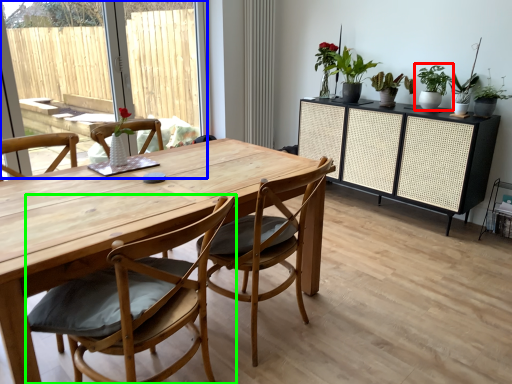
Question: Based on their relative distances, which object is farther from houseplant (highlighted by a red box)? Choose from window screen (highlighted by a blue box) and chair (highlighted by a green box).

Choices:
 (A) window screen
 (B) chair

Answer: (A)